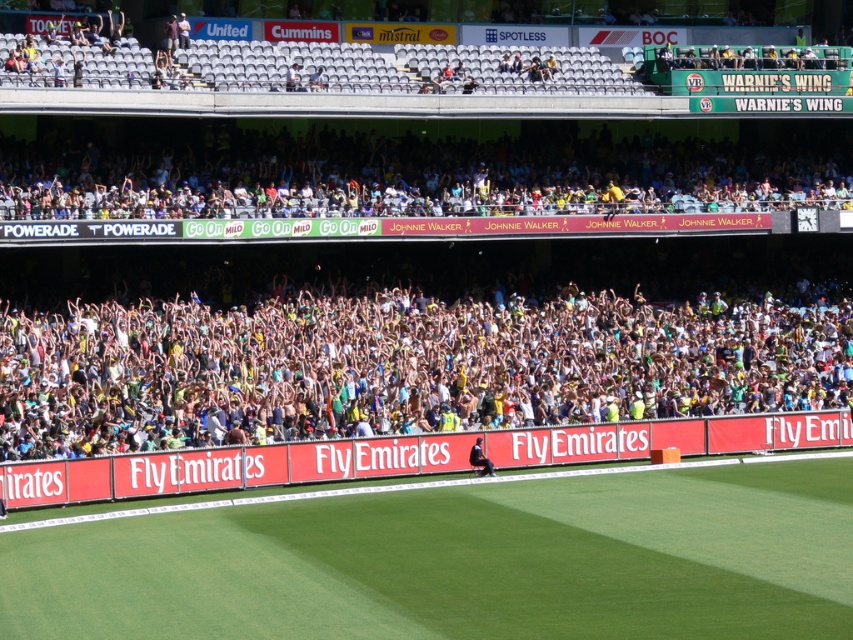
You are a photographer standing at the camera position. You want to capture a closeup of the green grass football field at center. Given that your camera can focus on objects within 25 meters, will you be able to take the closeup without moving closer?

The green grass football field at center is 27.17 meters away from camera, which is beyond the camera focus range of 25 meters. Therefore, you cannot take the closeup without moving closer.